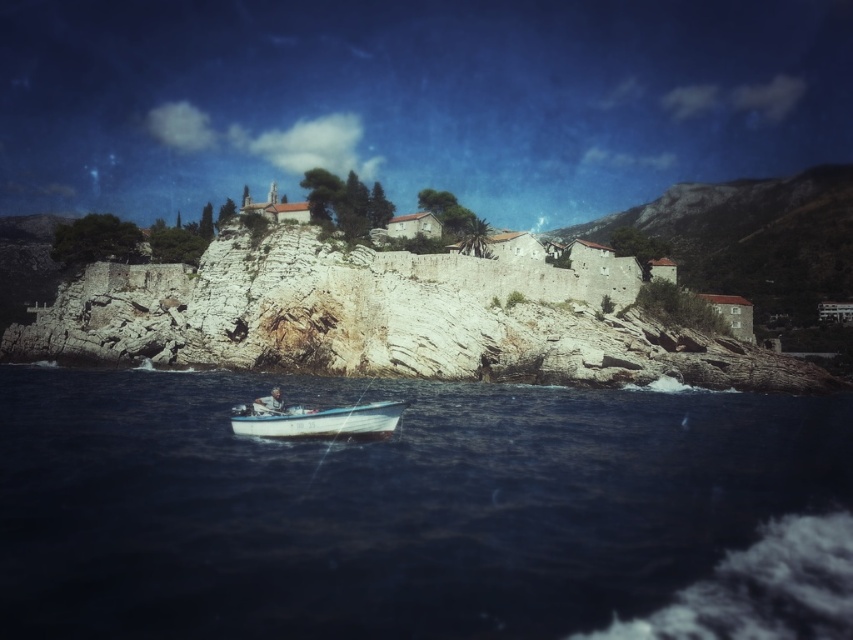
You are standing on the rocky coastline observing the two boats in the water. Which boat, the white matte boat at lower center or the white plastic boat at lower center, is positioned closer to the right side of the scene?

The white matte boat at lower center is positioned to the right of the white plastic boat at lower center, so the white matte boat at lower center is closer to the right side of the scene.

You are standing on the shore looking out at the scene. Which object, the blue water at lower center or the white stone cliff at center, appears closer to you?

The blue water at lower center appears closer to you because it has a lesser height compared to the white stone cliff at center, indicating it is positioned lower in the visual plane.